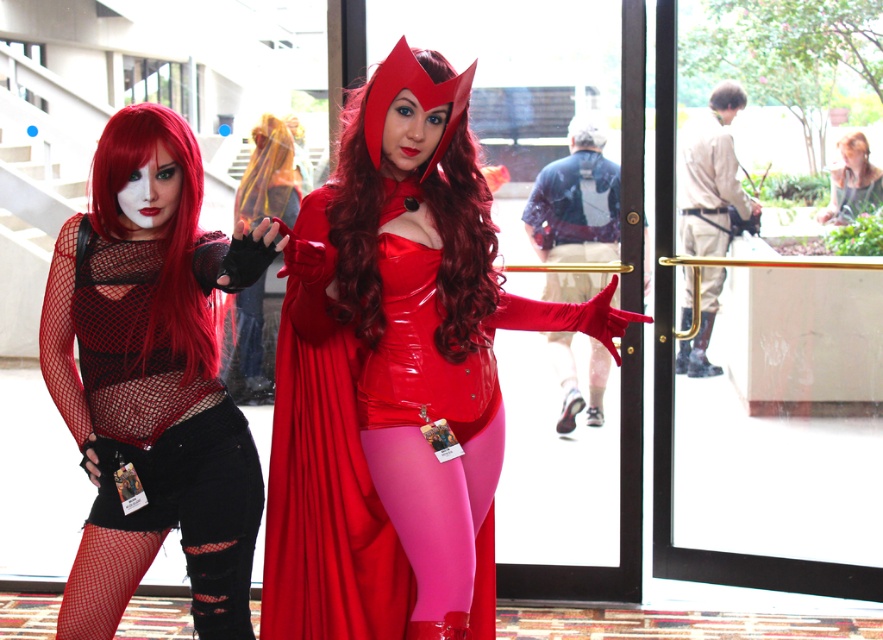
Question: Which of the following is the farthest from the observer?

Choices:
 (A) shiny red costume at center
 (B) matte black wig at upper center

Answer: (B)

Question: Can you confirm if red mesh wig at left is positioned above matte black wig at upper center?

Choices:
 (A) no
 (B) yes

Answer: (A)

Question: Which point is farther from the camera taking this photo?

Choices:
 (A) (826, 220)
 (B) (245, 486)

Answer: (A)

Question: Estimate the real-world distances between objects in this image. Which object is closer to the red mesh wig at left?

Choices:
 (A) fishnet fabric top at left
 (B) matte black wig at upper center

Answer: (A)

Question: Does shiny red costume at center have a greater width compared to red mesh wig at left?

Choices:
 (A) yes
 (B) no

Answer: (A)

Question: Does shiny red costume at center appear on the left side of fishnet fabric top at left?

Choices:
 (A) no
 (B) yes

Answer: (A)